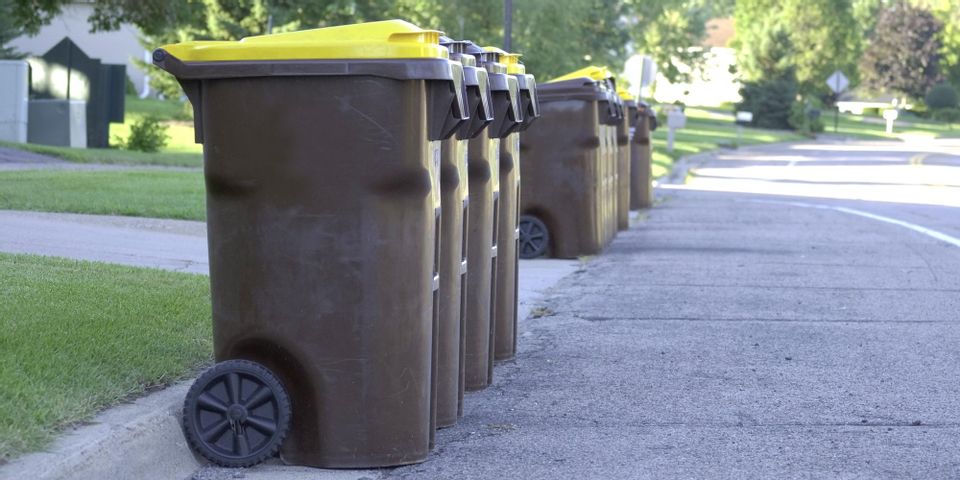
The height and width of the screenshot is (480, 960). What are the coordinates of `garbage pails` in the screenshot? It's located at (386, 278), (457, 254), (477, 252), (506, 240), (594, 143), (607, 144), (615, 144), (622, 148), (640, 151).